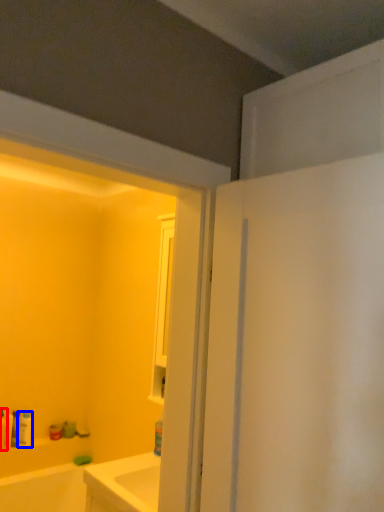
Question: Which point is closer to the camera, toiletry (highlighted by a red box) or toiletry (highlighted by a blue box)?

Choices:
 (A) toiletry
 (B) toiletry

Answer: (A)